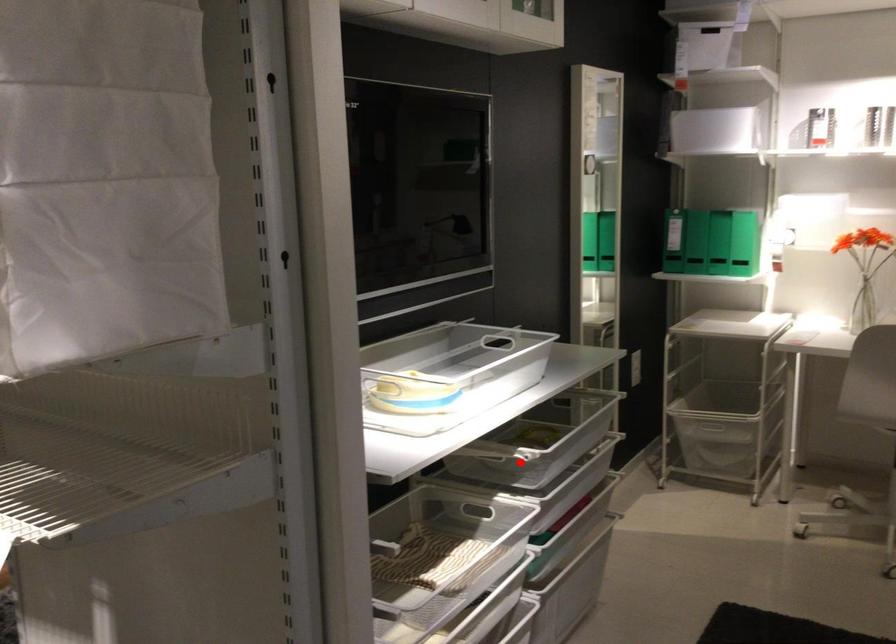
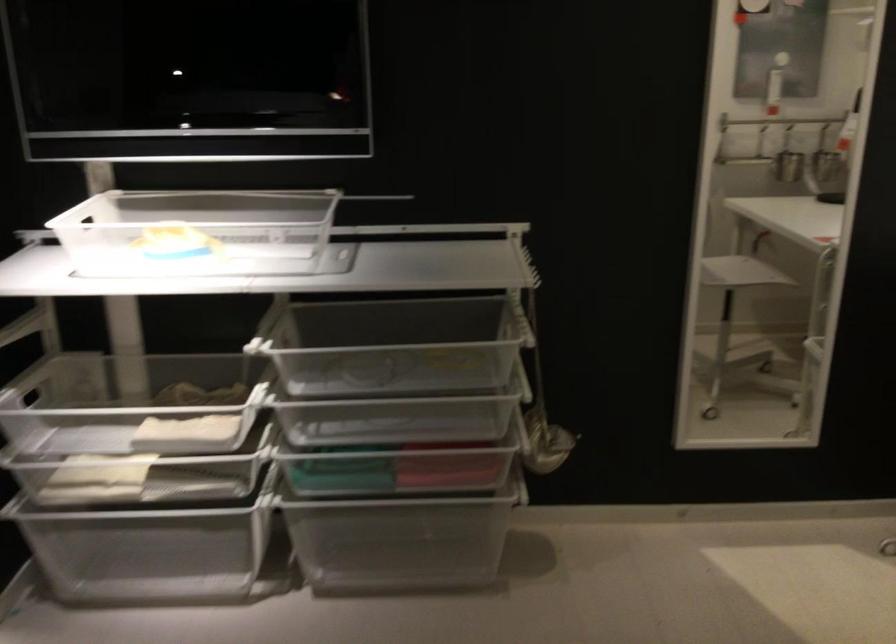
Question: I am providing you with two images of the same scene from different viewpoints. A red point is marked on the first image. Is the red point's position out of view in image 2?

Choices:
 (A) Yes
 (B) No

Answer: (B)